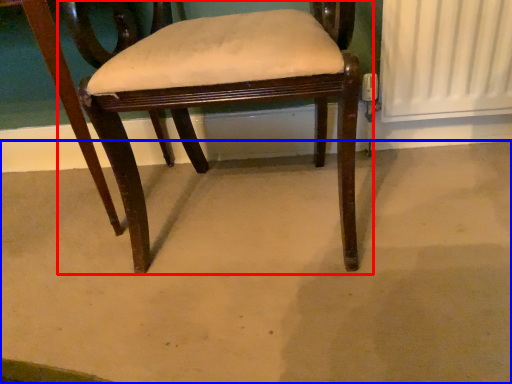
Question: Which object is further to the camera taking this photo, chair (highlighted by a red box) or concrete (highlighted by a blue box)?

Choices:
 (A) chair
 (B) concrete

Answer: (A)